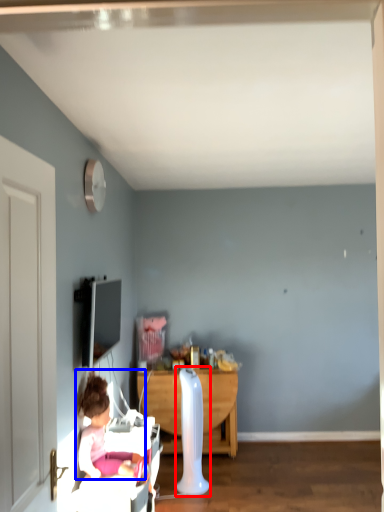
Question: Among these objects, which one is nearest to the camera, radiator (highlighted by a red box) or person (highlighted by a blue box)?

Choices:
 (A) radiator
 (B) person

Answer: (B)